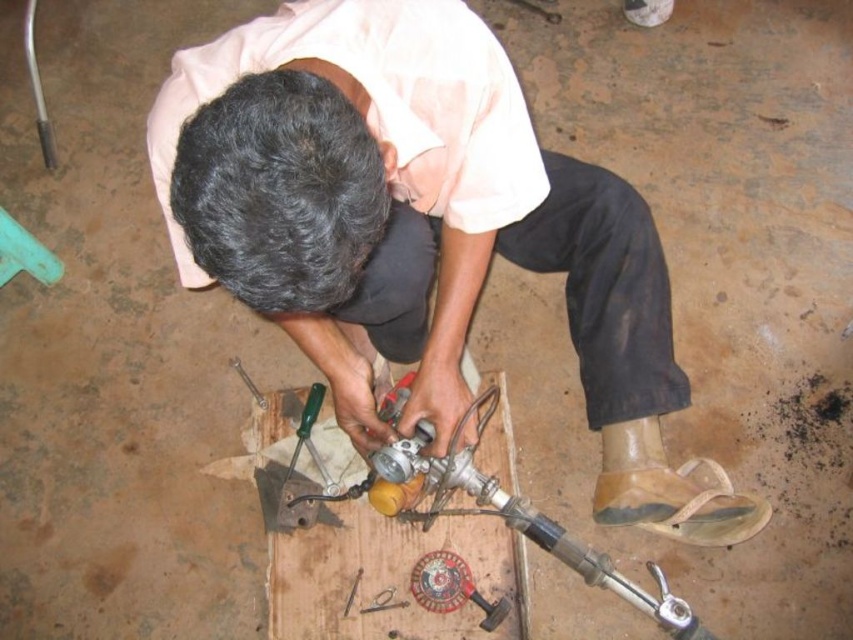
Based on the photo, is matte black shirt at center shorter than metallic screwdriver at lower center?

Answer: Incorrect, matte black shirt at center's height does not fall short of metallic screwdriver at lower center's.

Can you confirm if matte black shirt at center is positioned above metallic screwdriver at lower center?

Yes.

Who is more distant from viewer, (422, 188) or (241, 365)?

The point (241, 365) is behind.

Locate an element on the screen. The image size is (853, 640). matte black shirt at center is located at coordinates (421, 227).